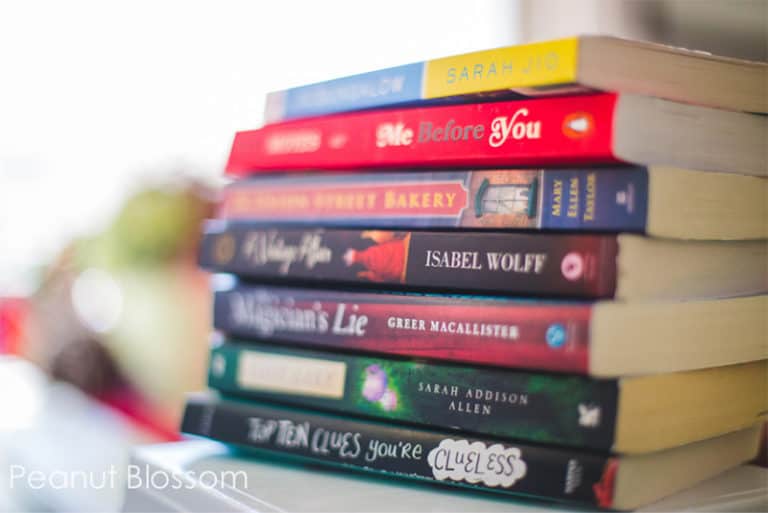
You are a GUI agent. You are given a task and a screenshot of the screen. Output one action in this format:
    pyautogui.click(x=<x>, y=<y>)
    Task: Click on the book
    The image size is (768, 513).
    Given the screenshot: What is the action you would take?
    pyautogui.click(x=550, y=69), pyautogui.click(x=565, y=127), pyautogui.click(x=578, y=184), pyautogui.click(x=565, y=267), pyautogui.click(x=538, y=313), pyautogui.click(x=538, y=401), pyautogui.click(x=528, y=468)